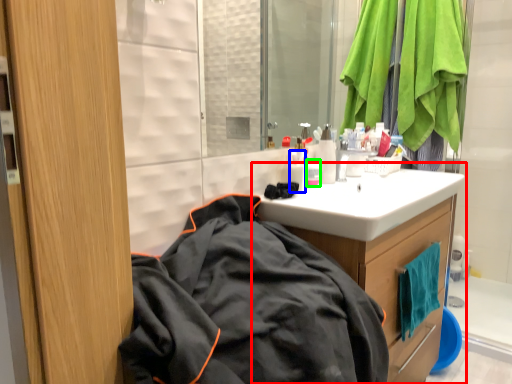
Question: Which object is the farthest from bathroom cabinet (highlighted by a red box)? Choose among these: toiletry (highlighted by a blue box) or toiletry (highlighted by a green box).

Choices:
 (A) toiletry
 (B) toiletry

Answer: (A)